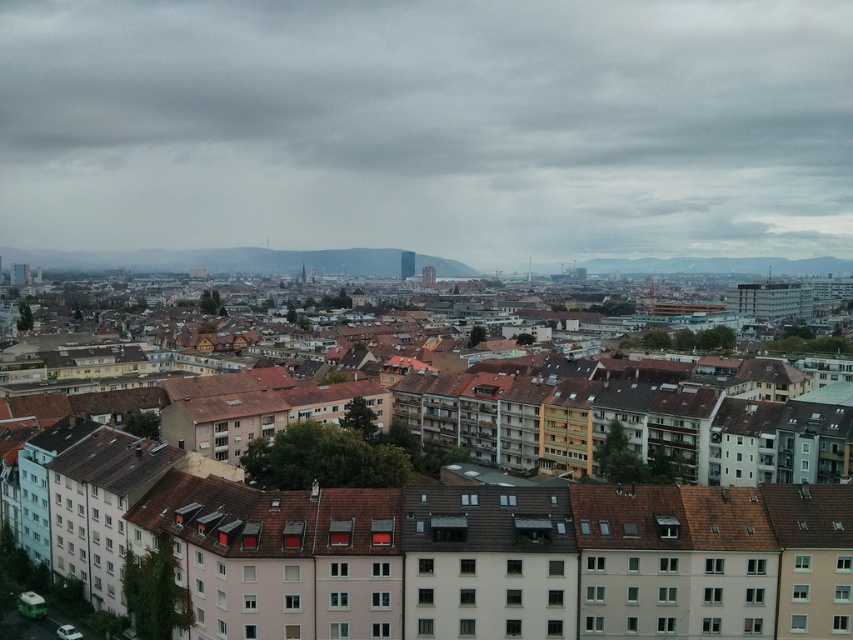
You are standing in the urban area shown in the image and want to determine the relative positions of two points marked in the scene. Which point, point 1 at coordinates (216, 195) or point 2 at coordinates (393, 579), is closer to you?

Point 1 at coordinates (216, 195) is closer to you because it is further to the viewer than point 2 at coordinates (393, 579).

You are an urban planner analyzing the city layout. You need to determine the exact location of the cloudy sky at center in the image. What are its coordinates?

The cloudy sky at center is located at coordinates point (428, 125).